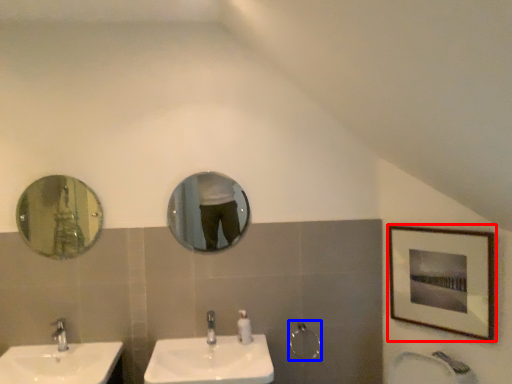
Question: Which object appears farthest to the camera in this image, picture frame (highlighted by a red box) or shower (highlighted by a blue box)?

Choices:
 (A) picture frame
 (B) shower

Answer: (B)